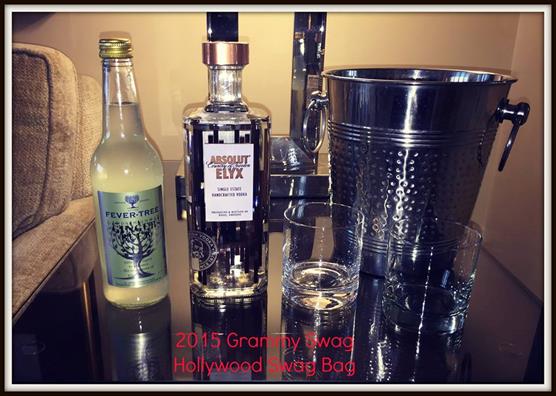
What are the coordinates of `glass cup` in the screenshot? It's located at (324, 257), (402, 269).